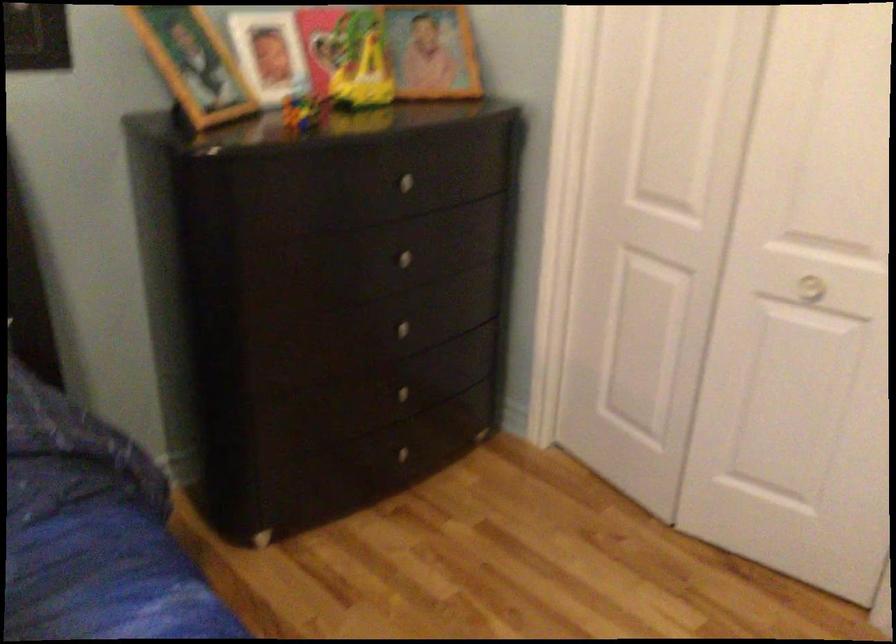
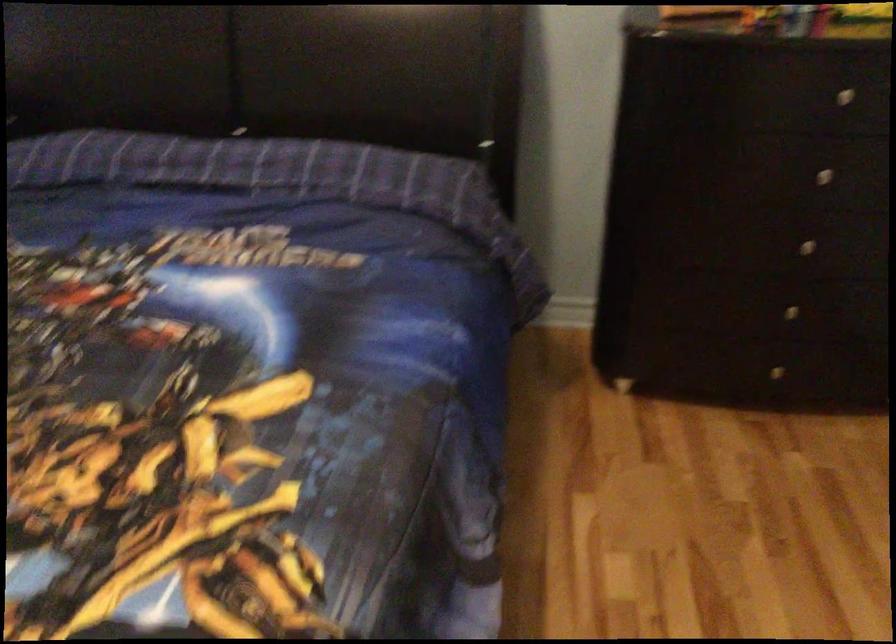
Locate, in the second image, the point that corresponds to point 410,389 in the first image.

(790, 310)